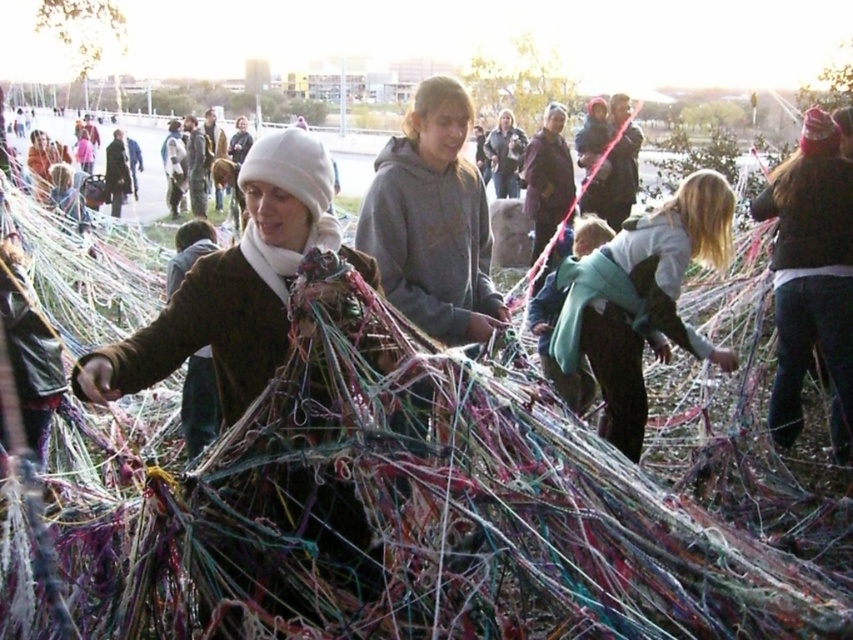
Is gray hoodie at center positioned at the back of light blue fabric at center?

No, it is in front of light blue fabric at center.

Between gray hoodie at center and light blue fabric at center, which one is positioned lower?

light blue fabric at center is below.

Identify the location of gray hoodie at center. (432, 221).